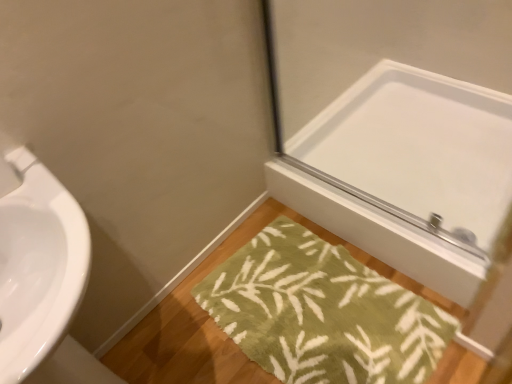
The image size is (512, 384). What are the coordinates of `green fuzzy bath mat at lower center` in the screenshot? It's located at (322, 312).

This screenshot has height=384, width=512. What do you see at coordinates (322, 312) in the screenshot? I see `green fuzzy bath mat at lower center` at bounding box center [322, 312].

Locate an element on the screen. white glossy mirror at upper right is located at coordinates (418, 144).

This screenshot has height=384, width=512. Describe the element at coordinates (418, 144) in the screenshot. I see `white glossy mirror at upper right` at that location.

Identify the location of green fuzzy bath mat at lower center. (322, 312).

Which object is positioned more to the left, white glossy mirror at upper right or green fuzzy bath mat at lower center?

green fuzzy bath mat at lower center is more to the left.

Is white glossy mirror at upper right in front of or behind green fuzzy bath mat at lower center in the image?

Clearly, white glossy mirror at upper right is behind green fuzzy bath mat at lower center.

Is point (314, 144) behind point (254, 257)?

Yes, point (314, 144) is farther from viewer.

From the image's perspective, between white glossy mirror at upper right and green fuzzy bath mat at lower center, which one is located above?

white glossy mirror at upper right, from the image's perspective.

From a real-world perspective, is white glossy mirror at upper right physically below green fuzzy bath mat at lower center?

Actually, white glossy mirror at upper right is physically above green fuzzy bath mat at lower center in the real world.

Does white glossy mirror at upper right have a lesser width compared to green fuzzy bath mat at lower center?

Incorrect, the width of white glossy mirror at upper right is not less than that of green fuzzy bath mat at lower center.

Which of these two, white glossy mirror at upper right or green fuzzy bath mat at lower center, stands taller?

white glossy mirror at upper right is taller.

Is white glossy mirror at upper right bigger or smaller than green fuzzy bath mat at lower center?

In the image, white glossy mirror at upper right appears to be larger than green fuzzy bath mat at lower center.

Is white glossy mirror at upper right inside or outside of green fuzzy bath mat at lower center?

white glossy mirror at upper right cannot be found inside green fuzzy bath mat at lower center.

Is white glossy mirror at upper right beside green fuzzy bath mat at lower center?

No, white glossy mirror at upper right is not in contact with green fuzzy bath mat at lower center.

Could you tell me if white glossy mirror at upper right is turned towards green fuzzy bath mat at lower center?

Yes.

How different are the orientations of white glossy mirror at upper right and green fuzzy bath mat at lower center in degrees?

There is a 1.65-degree angle between the facing directions of white glossy mirror at upper right and green fuzzy bath mat at lower center.

How far apart are white glossy mirror at upper right and green fuzzy bath mat at lower center?

A distance of 21.49 inches exists between white glossy mirror at upper right and green fuzzy bath mat at lower center.

Find the location of `bath mat located on the left of white glossy mirror at upper right`. bath mat located on the left of white glossy mirror at upper right is located at coordinates (322, 312).

Based on the photo, is green fuzzy bath mat at lower center to the left or to the right of white glossy mirror at upper right in the image?

green fuzzy bath mat at lower center is positioned on white glossy mirror at upper right's left side.

Which is in front, green fuzzy bath mat at lower center or white glossy mirror at upper right?

green fuzzy bath mat at lower center is closer to the camera.

Which is in front, point (378, 333) or point (507, 101)?

Point (378, 333)

From the image's perspective, which one is positioned lower, green fuzzy bath mat at lower center or white glossy mirror at upper right?

From the image's view, green fuzzy bath mat at lower center is below.

From a real-world perspective, between green fuzzy bath mat at lower center and white glossy mirror at upper right, who is vertically higher?

In real-world perspective, white glossy mirror at upper right is above.

Which of these two, green fuzzy bath mat at lower center or white glossy mirror at upper right, is wider?

white glossy mirror at upper right is wider.

Considering the sizes of objects green fuzzy bath mat at lower center and white glossy mirror at upper right in the image provided, who is taller, green fuzzy bath mat at lower center or white glossy mirror at upper right?

With more height is white glossy mirror at upper right.

Based on their sizes in the image, would you say green fuzzy bath mat at lower center is bigger or smaller than white glossy mirror at upper right?

Clearly, green fuzzy bath mat at lower center is smaller in size than white glossy mirror at upper right.

Is green fuzzy bath mat at lower center surrounding white glossy mirror at upper right?

That's incorrect, white glossy mirror at upper right is not inside green fuzzy bath mat at lower center.

Is the surface of green fuzzy bath mat at lower center in direct contact with white glossy mirror at upper right?

No, green fuzzy bath mat at lower center is not with white glossy mirror at upper right.

Is green fuzzy bath mat at lower center looking in the opposite direction of white glossy mirror at upper right?

Correct, green fuzzy bath mat at lower center is looking away from white glossy mirror at upper right.

What's the angular difference between green fuzzy bath mat at lower center and white glossy mirror at upper right's facing directions?

The facing directions of green fuzzy bath mat at lower center and white glossy mirror at upper right are 1.65 degrees apart.

This screenshot has height=384, width=512. In the image, there is a white glossy mirror at upper right. Find the location of `bath mat below it (from the image's perspective)`. bath mat below it (from the image's perspective) is located at coordinates (322, 312).

Find the location of a particular element. mirror above the green fuzzy bath mat at lower center (from the image's perspective) is located at coordinates (418, 144).

The image size is (512, 384). Identify the location of bath mat that appears in front of the white glossy mirror at upper right. (322, 312).